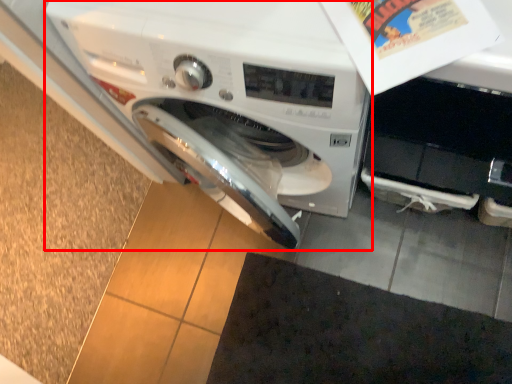
Question: From the image's perspective, considering the relative positions of washing machine (annotated by the red box) and doormat in the image provided, where is washing machine (annotated by the red box) located with respect to the staircase?

Choices:
 (A) below
 (B) above

Answer: (B)